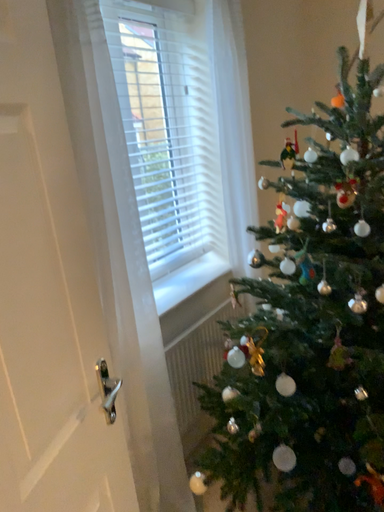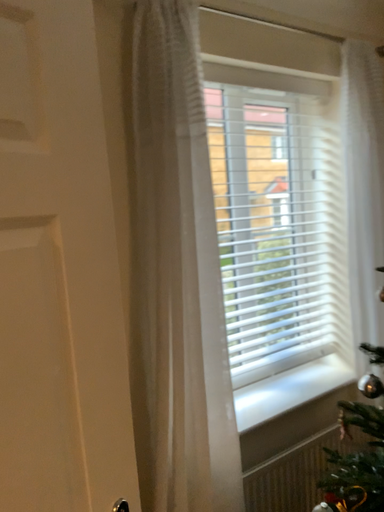
Question: How did the camera likely rotate when shooting the video?

Choices:
 (A) rotated left
 (B) rotated right

Answer: (A)